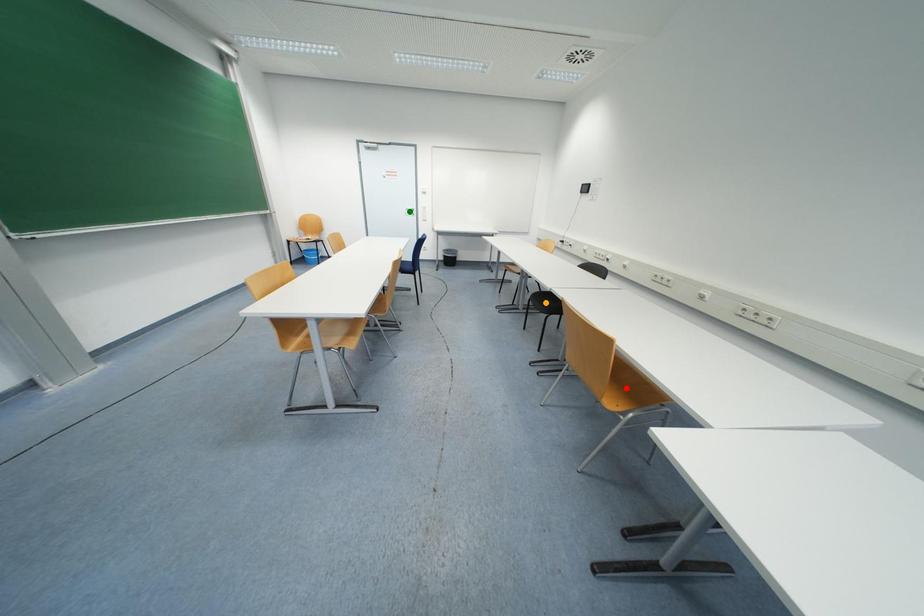
Order these from farthest to nearest:
green point, red point, orange point

1. green point
2. orange point
3. red point